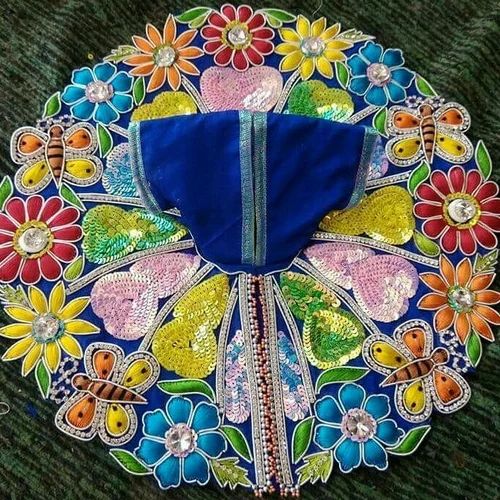
Identify the location of table. (25, 449).